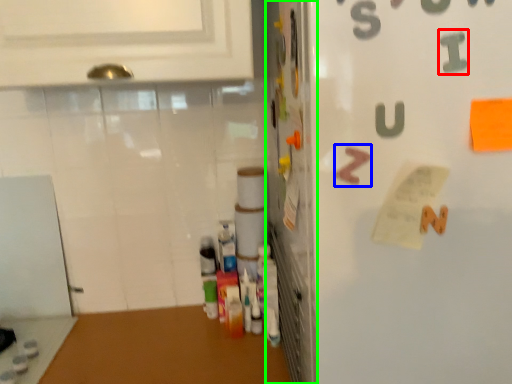
Question: Based on their relative distances, which object is nearer to alphabet (highlighted by a red box)? Choose from alphabet (highlighted by a blue box) and door (highlighted by a green box).

Choices:
 (A) alphabet
 (B) door

Answer: (A)